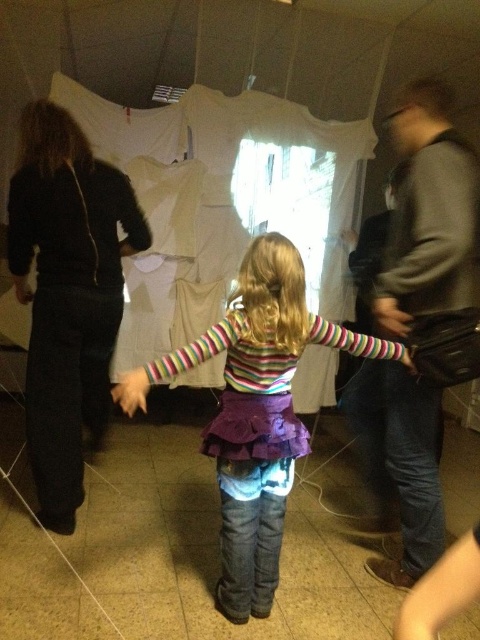
You are standing in the room and want to place a small decoration between the two points, point (91,333) and point (24,291). Which point should you move the decoration closer to so it appears larger to someone looking from the front?

To make the decoration appear larger to someone looking from the front, place it closer to point (91,333) since it is closer to the viewer compared to point (24,291).

You are a photographer setting up a shoot in the room. You notice the black fabric pants at left and the smooth black hand at lower left. Which object is bigger in size?

The black fabric pants at left has a larger size compared to the smooth black hand at lower left.